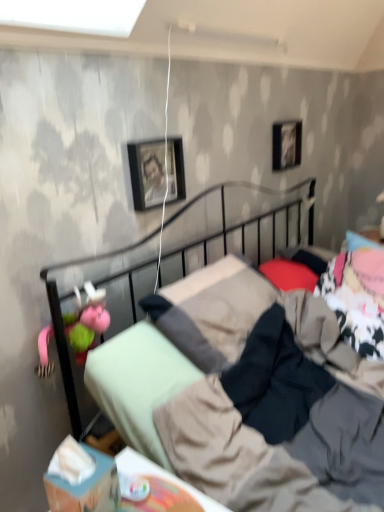
Question: Is black glossy picture frame at upper right, placed as the first picture frame when sorted from back to front, next to red matte pillow at center, marked as the second pillow in a top-to-bottom arrangement, and touching it?

Choices:
 (A) no
 (B) yes

Answer: (A)

Question: Is black glossy picture frame at upper right, the 1th picture frame from the top, looking in the opposite direction of red matte pillow at center, the 2th pillow in the right-to-left sequence?

Choices:
 (A) no
 (B) yes

Answer: (A)

Question: Are black glossy picture frame at upper right, arranged as the second picture frame when viewed from the front, and red matte pillow at center, acting as the 1th pillow starting from the left, far apart?

Choices:
 (A) yes
 (B) no

Answer: (B)

Question: Is black glossy picture frame at upper right, which appears as the first picture frame when viewed from the right, further to the viewer compared to red matte pillow at center, acting as the 1th pillow starting from the left?

Choices:
 (A) yes
 (B) no

Answer: (A)

Question: From a real-world perspective, is black glossy picture frame at upper right, placed as the first picture frame when sorted from back to front, under red matte pillow at center, the 2th pillow in the right-to-left sequence?

Choices:
 (A) yes
 (B) no

Answer: (B)

Question: Can you confirm if black glossy picture frame at upper right, the 1th picture frame from the top, is taller than red matte pillow at center, the 2th pillow in the right-to-left sequence?

Choices:
 (A) no
 (B) yes

Answer: (B)

Question: Is metallic black bed at center positioned before black matte picture frame at upper center, which is the 1th picture frame from bottom to top?

Choices:
 (A) yes
 (B) no

Answer: (A)

Question: Is the depth of metallic black bed at center greater than that of black matte picture frame at upper center, which is the second picture frame in right-to-left order?

Choices:
 (A) yes
 (B) no

Answer: (B)

Question: Is metallic black bed at center beside black matte picture frame at upper center, which ranks as the second picture frame in top-to-bottom order?

Choices:
 (A) yes
 (B) no

Answer: (B)

Question: Is metallic black bed at center positioned far away from black matte picture frame at upper center, which is the 1th picture frame from bottom to top?

Choices:
 (A) yes
 (B) no

Answer: (B)

Question: From a real-world perspective, is metallic black bed at center located higher than black matte picture frame at upper center, acting as the 1th picture frame starting from the front?

Choices:
 (A) no
 (B) yes

Answer: (A)

Question: From the image's perspective, is metallic black bed at center over black matte picture frame at upper center, which is the first picture frame from left to right?

Choices:
 (A) yes
 (B) no

Answer: (B)

Question: Is metallic black bed at center aimed at pink fabric doll at left?

Choices:
 (A) no
 (B) yes

Answer: (A)